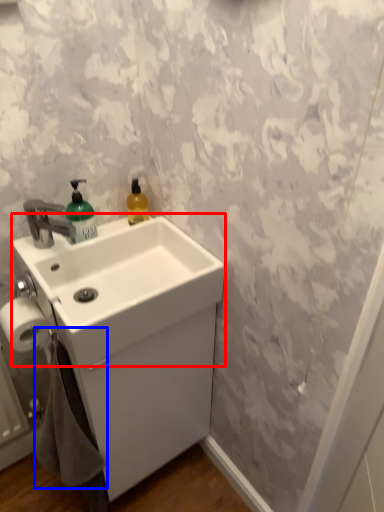
Question: Which object is closer to the camera taking this photo, counter top (highlighted by a red box) or bath towel (highlighted by a blue box)?

Choices:
 (A) counter top
 (B) bath towel

Answer: (A)